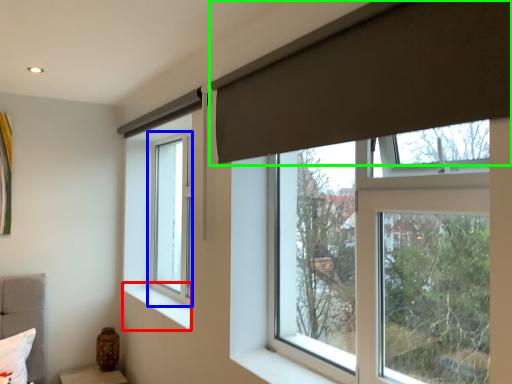
Question: Based on their relative distances, which object is farther from window sill (highlighted by a red box)? Choose from window (highlighted by a blue box) and curtain (highlighted by a green box).

Choices:
 (A) window
 (B) curtain

Answer: (B)